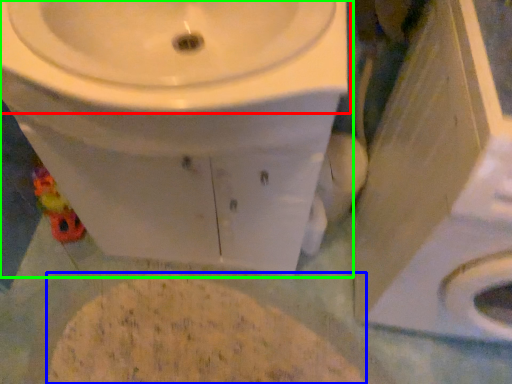
Question: Which object is positioned closest to sink (highlighted by a red box)? Select from flour (highlighted by a blue box) and toilet (highlighted by a green box).

Choices:
 (A) flour
 (B) toilet

Answer: (B)